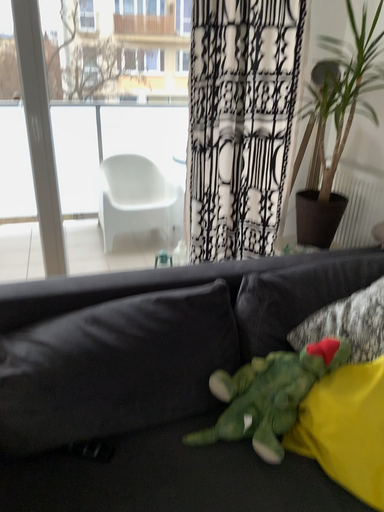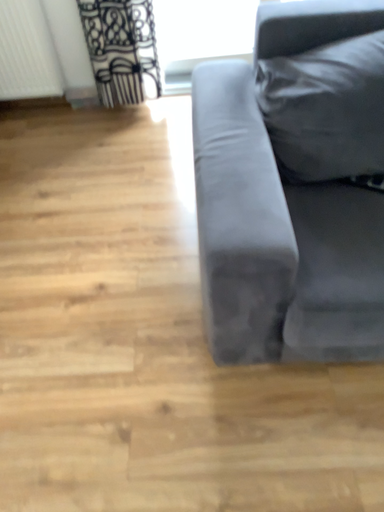
Question: How did the camera likely rotate when shooting the video?

Choices:
 (A) rotated upward
 (B) rotated downward

Answer: (B)